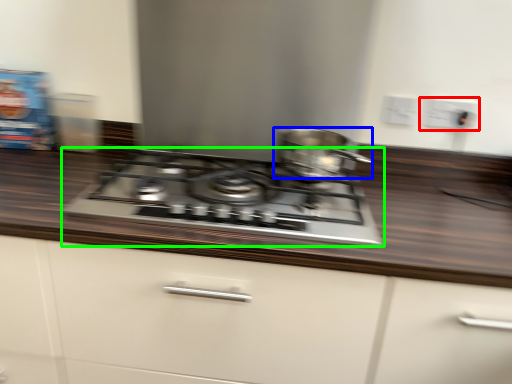
Question: Which object is the farthest from electric outlet (highlighted by a red box)? Choose among these: kitchen appliance (highlighted by a blue box) or gas stove (highlighted by a green box).

Choices:
 (A) kitchen appliance
 (B) gas stove

Answer: (B)